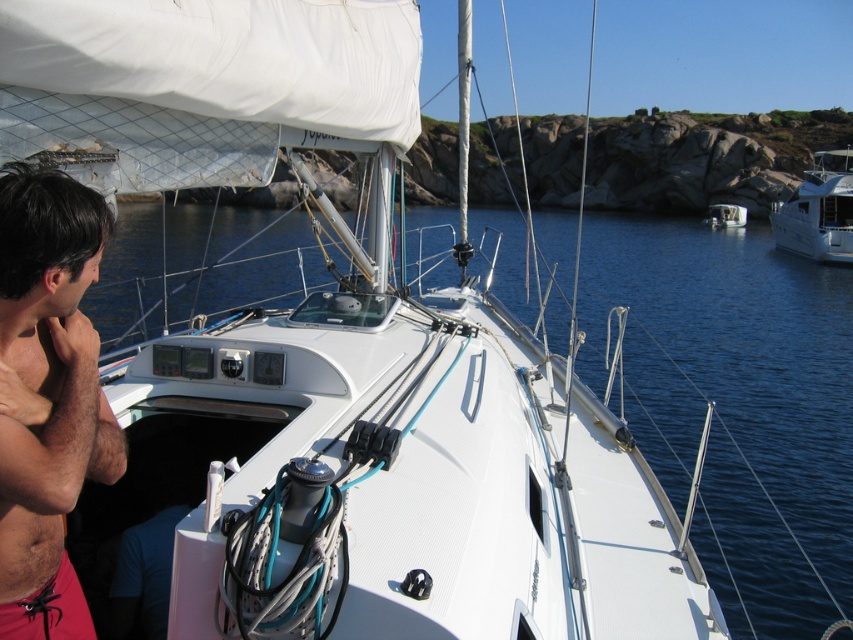
Is shiny black hair at left to the left of hair/fuzzy skin at left from the viewer's perspective?

Yes, shiny black hair at left is to the left of hair/fuzzy skin at left.

Is point (68, 323) positioned behind point (24, 452)?

Yes.

Where is `shiny black hair at left`? shiny black hair at left is located at coordinates (47, 396).

Is shiny black hair at left to the right of white glossy boat at right from the viewer's perspective?

In fact, shiny black hair at left is to the left of white glossy boat at right.

Is point (33, 540) farther from viewer compared to point (801, 189)?

No.

In order to click on shiny black hair at left in this screenshot , I will do point(47,396).

Is white glossy boat at right positioned before white glossy boat at center?

Yes.

Which is behind, point (821, 200) or point (738, 227)?

Positioned behind is point (738, 227).

I want to click on white glossy boat at right, so click(x=817, y=211).

Locate an element on the screen. This screenshot has height=640, width=853. white glossy boat at right is located at coordinates (817, 211).